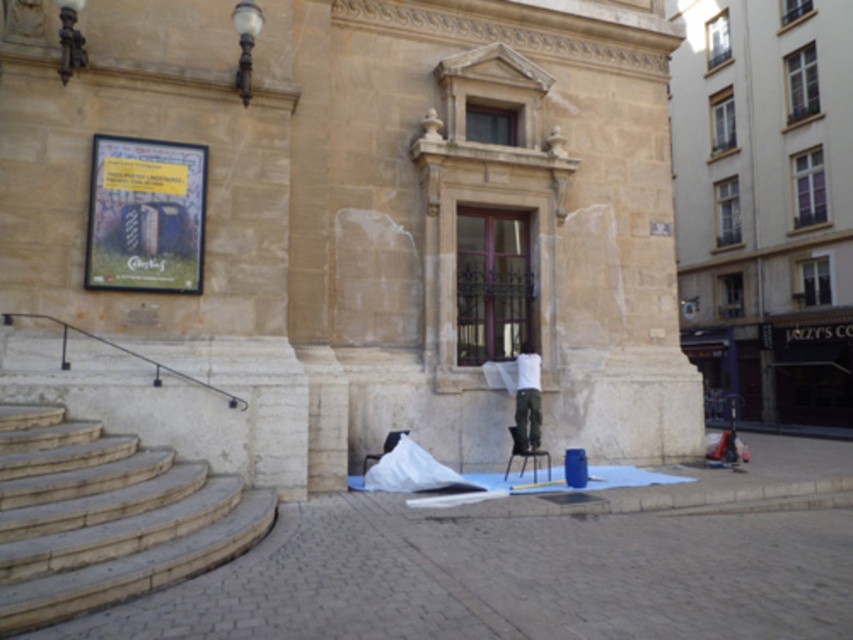
Between paved stone pavement at lower center and white matte shirt at center, which one appears on the right side from the viewer's perspective?

white matte shirt at center

Can you confirm if paved stone pavement at lower center is bigger than white matte shirt at center?

No.

Does point (846, 538) come farther from viewer compared to point (531, 433)?

No, (846, 538) is closer to viewer.

Find the location of a particular element. The width and height of the screenshot is (853, 640). paved stone pavement at lower center is located at coordinates (508, 579).

Identify the location of paved stone pavement at lower center. The image size is (853, 640). (508, 579).

From the picture: Is paved stone pavement at lower center thinner than wooden stairs at lower left?

In fact, paved stone pavement at lower center might be wider than wooden stairs at lower left.

Is point (276, 632) positioned before point (108, 582)?

Yes, it is in front of point (108, 582).

Image resolution: width=853 pixels, height=640 pixels. Find the location of `paved stone pavement at lower center`. paved stone pavement at lower center is located at coordinates (508, 579).

Image resolution: width=853 pixels, height=640 pixels. Describe the element at coordinates (106, 516) in the screenshot. I see `wooden stairs at lower left` at that location.

Is wooden stairs at lower left smaller than white matte shirt at center?

No.

Consider the image. Who is more distant from viewer, (161,492) or (534,362)?

Positioned behind is point (534,362).

The height and width of the screenshot is (640, 853). What are the coordinates of `wooden stairs at lower left` in the screenshot? It's located at (106, 516).